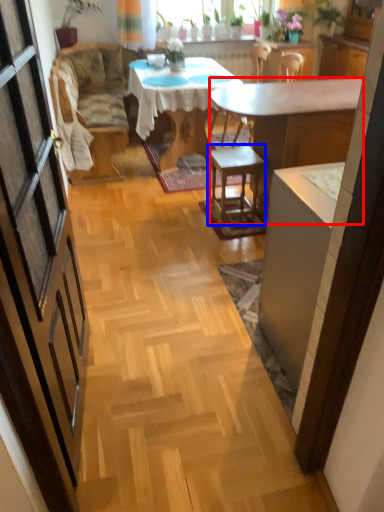
Question: Which object is further to the camera taking this photo, desk (highlighted by a red box) or stool (highlighted by a blue box)?

Choices:
 (A) desk
 (B) stool

Answer: (B)